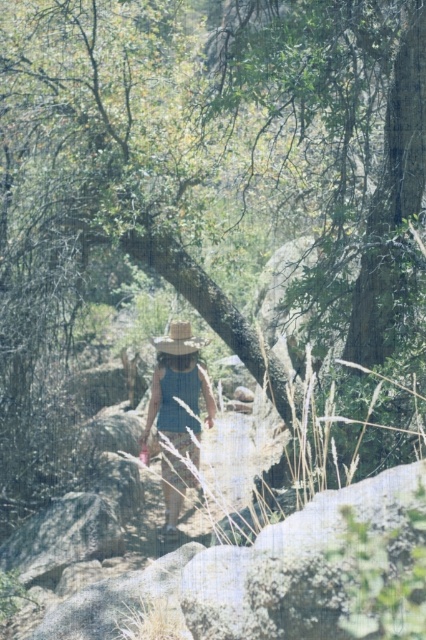
Can you confirm if blue denim dress at center is thinner than light brown straw cowboy hat at center?

Incorrect, blue denim dress at center's width is not less than light brown straw cowboy hat at center's.

Who is more forward, (198,356) or (181,324)?

Point (181,324)

What do you see at coordinates (178, 390) in the screenshot? The width and height of the screenshot is (426, 640). I see `blue denim dress at center` at bounding box center [178, 390].

Locate an element on the screen. The width and height of the screenshot is (426, 640). blue denim dress at center is located at coordinates (178, 390).